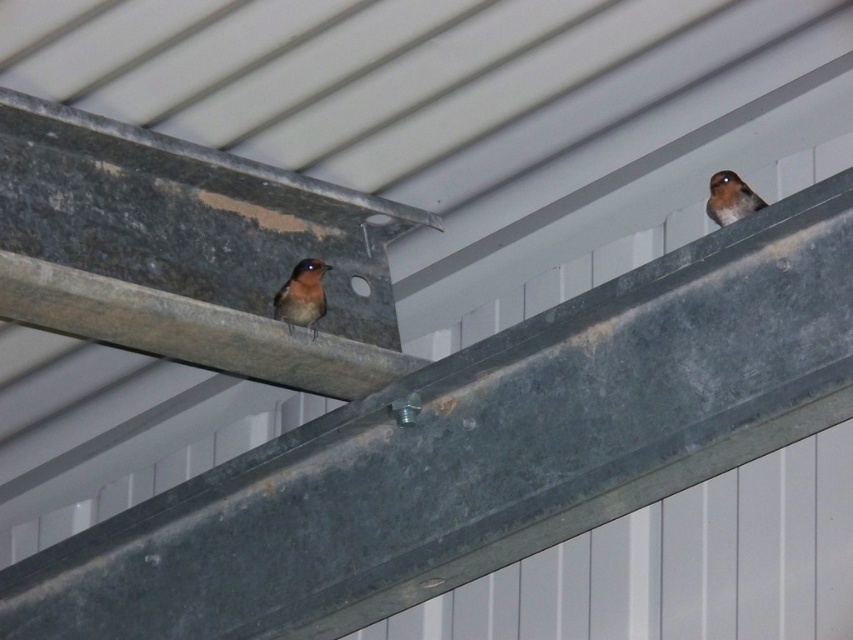
You are a bird enthusiast observing two brown feathered birds perched on a metallic beam. You want to know if the distance between the brown feathered bird at center and the brown feathered bird at upper right is enough for a small insect to fly through. Assuming the insect can fly 50 centimeters, can it pass between them?

The distance between the brown feathered bird at center and the brown feathered bird at upper right is 53.21 centimeters, which is greater than the insect can fly. Therefore, the insect can pass between them.

You are a birdwatcher trying to locate the brown feathered bird at center in the image. According to the coordinates provided, where exactly is the bird positioned?

The brown feathered bird at center is located at point coordinates of 0.463 along the x axis and 0.355 along the y axis.

You are a birdwatcher trying to identify the larger bird between the brown feathered bird at center and the brown feathered bird at upper right. Based on their positions and sizes in the image, which bird is wider?

The brown feathered bird at center is wider than the brown feathered bird at upper right according to their widths.